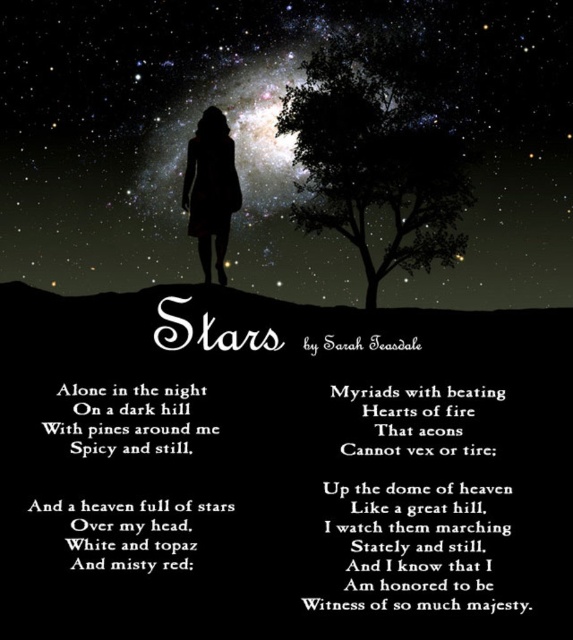
In the scene shown: Is green leafy tree at upper center bigger than matte black dress at center?

Answer: Indeed, green leafy tree at upper center has a larger size compared to matte black dress at center.

Which of these two, green leafy tree at upper center or matte black dress at center, stands taller?

With more height is green leafy tree at upper center.

Who is more forward, (340, 227) or (241, 202)?

Point (241, 202)

Locate an element on the screen. This screenshot has width=573, height=640. green leafy tree at upper center is located at coordinates (378, 150).